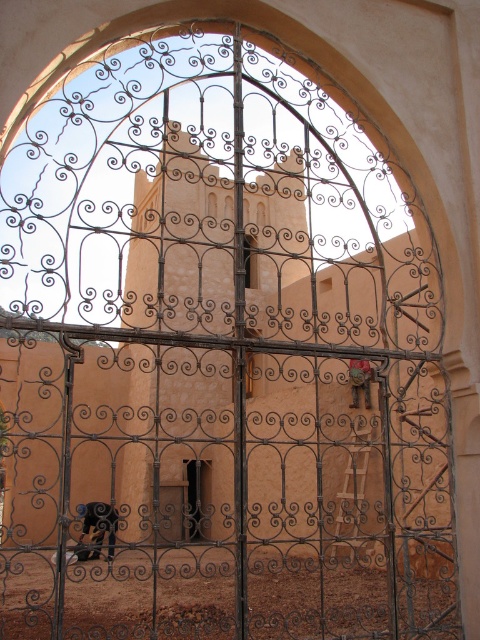
Question: Which point appears farthest from the camera in this image?

Choices:
 (A) click(168, 538)
 (B) click(206, 468)

Answer: (B)

Question: Does smooth wood door at center come in front of dark brown wrought iron door at center?

Choices:
 (A) yes
 (B) no

Answer: (B)

Question: Among these objects, which one is farthest from the camera?

Choices:
 (A) dark brown wrought iron door at center
 (B) smooth wood door at center

Answer: (B)

Question: Is smooth wood door at center positioned in front of dark brown wrought iron door at center?

Choices:
 (A) yes
 (B) no

Answer: (B)

Question: Does smooth wood door at center have a lesser width compared to dark brown wrought iron door at center?

Choices:
 (A) yes
 (B) no

Answer: (A)